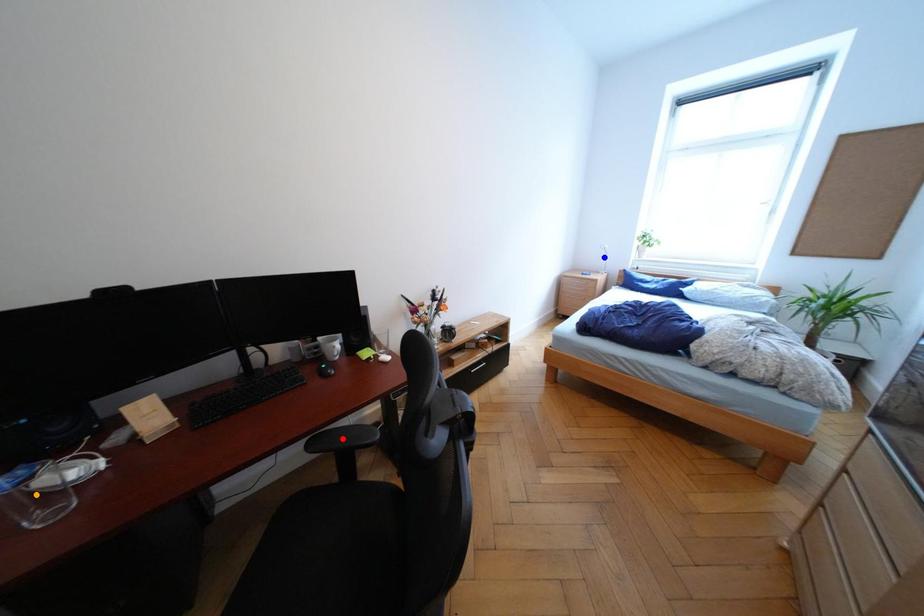
Order these from nearest to farthest:
A) red point
B) orange point
C) blue point

orange point
red point
blue point